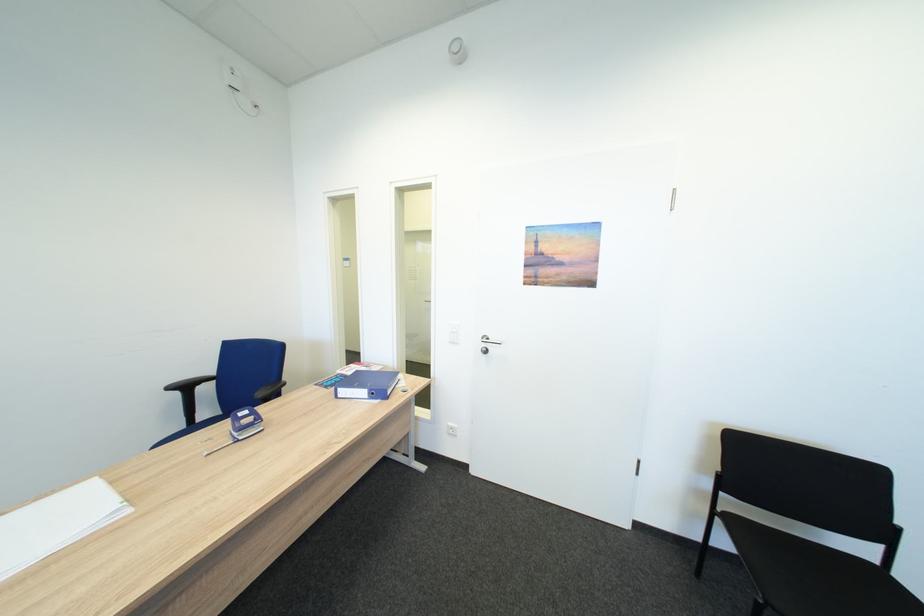
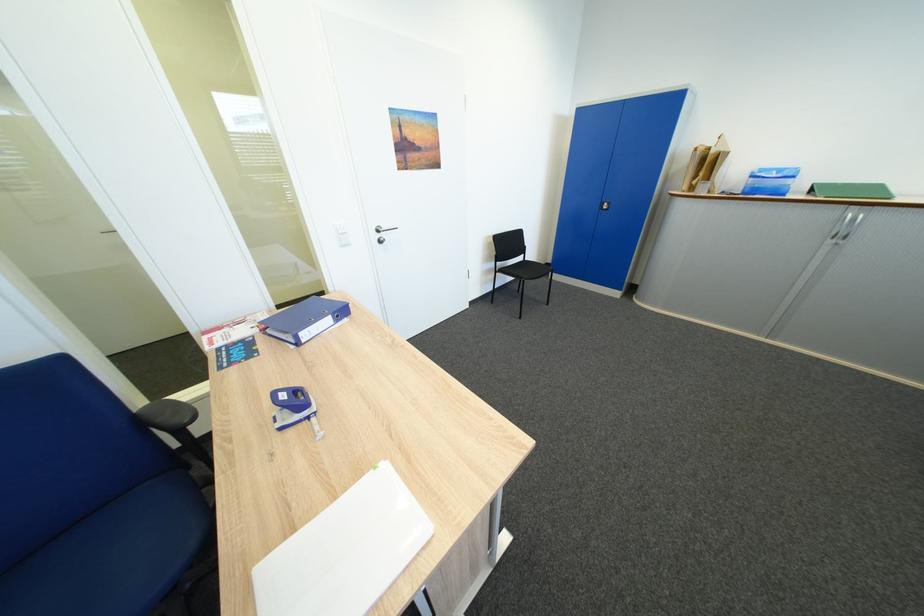
Locate, in the second image, the point that corresponds to point 349,391 in the first image.

(310, 334)